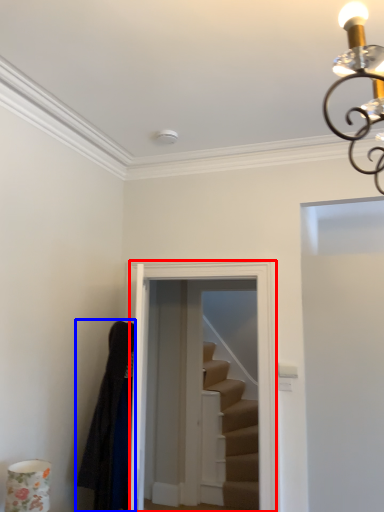
Question: Among these objects, which one is farthest to the camera, glass door (highlighted by a red box) or robe (highlighted by a blue box)?

Choices:
 (A) glass door
 (B) robe

Answer: (A)